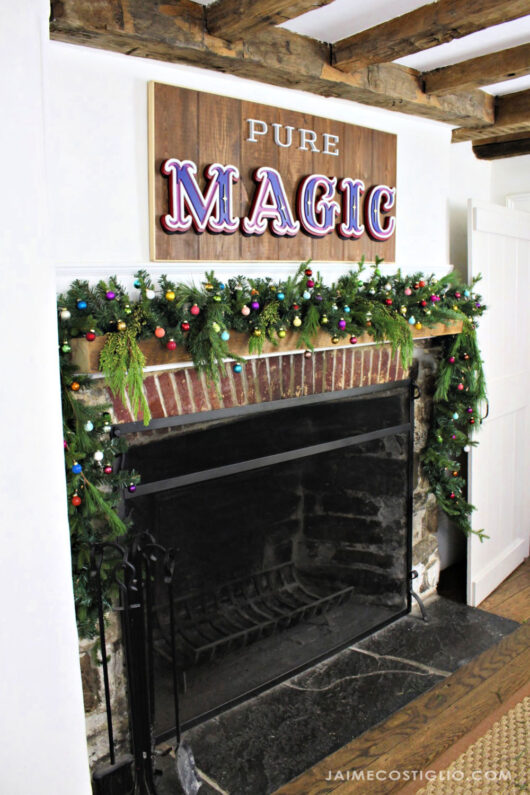
You are a GUI agent. You are given a task and a screenshot of the screen. Output one action in this format:
    pyautogui.click(x=<x>, y=<y>)
    Task: Click on the stone tile
    
    Given the screenshot: What is the action you would take?
    pyautogui.click(x=220, y=766), pyautogui.click(x=328, y=702), pyautogui.click(x=438, y=630)